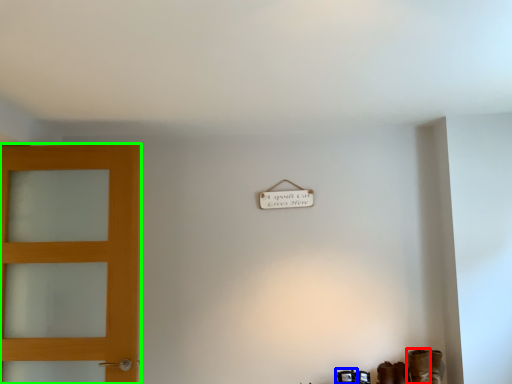
Question: Estimate the real-world distances between objects in this image. Which object is farther from boot (highlighted by a red box), shoe (highlighted by a blue box) or door (highlighted by a green box)?

Choices:
 (A) shoe
 (B) door

Answer: (B)